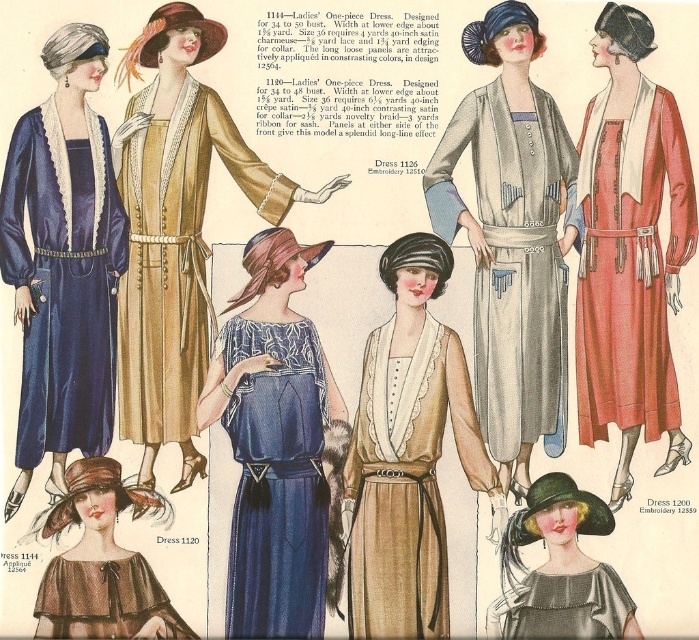
You are standing at the entrance of a room and see both the brown felt hat at lower left and the green felt hat at lower center. If you want to pick up the hat that is closer to you, which one should you choose?

The brown felt hat at lower left is 10.78 feet away from the green felt hat at lower center. Since the distance between them is the same from your position at the entrance, you need to determine which one is closer based on their positions. However, the description only provides the distance between the two hats, not their individual distances from you. Without additional information about their placement relative to the entrance, it is impossible to determine which hat is closer.

You are an artist examining the vintage fashion illustration. You notice two points marked in the image at coordinates point (603, 424) and point (310, 490). Which point is closer to the viewer?

Point (603, 424) is further to the camera than point (310, 490), so the point closer to the viewer is point (310, 490).

You are a customer trying to choose between the brown felt hat at lower left and the green felt hat at lower center. Which hat has a bigger size?

The brown felt hat at lower left is larger in size than the green felt hat at lower center.